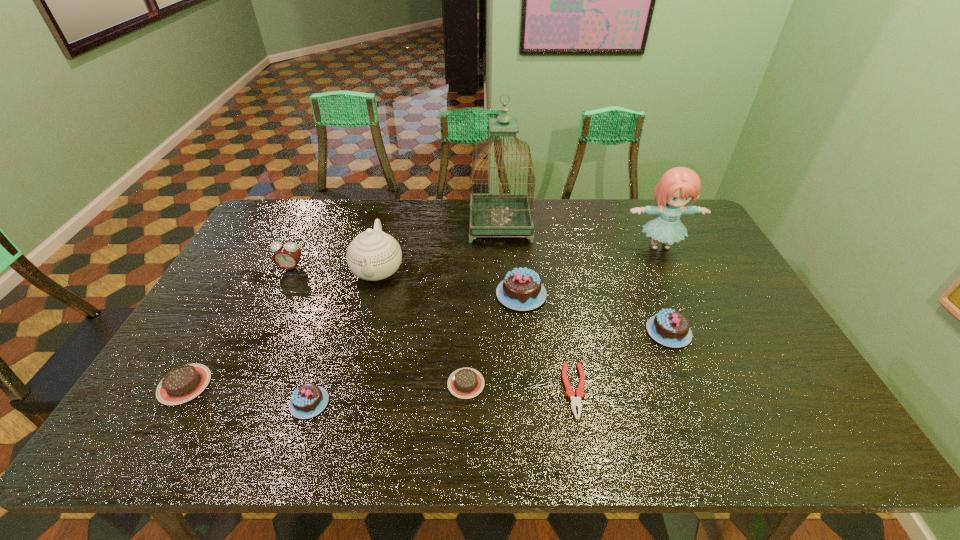
You are a GUI agent. You are given a task and a screenshot of the screen. Output one action in this format:
    pyautogui.click(x=<x>, y=<y>)
    Task: Click on the birdcage
    The width and height of the screenshot is (960, 540).
    Given the screenshot: What is the action you would take?
    pyautogui.click(x=490, y=214)

Locate an element on the screen. Image resolution: width=960 pixels, height=540 pixels. greenish birdcage is located at coordinates (490, 214).

Where is `blue doll`? blue doll is located at coordinates (677, 186).

The width and height of the screenshot is (960, 540). Identify the location of the ninth shortest object. (677, 186).

Where is `the eighth shortest object`? the eighth shortest object is located at coordinates (373, 255).

At what (x,y) coordinates should I click in order to perform the action: click on pink alarm clock. Please return your answer as a coordinate pair (x, y). Looking at the image, I should click on (286, 256).

I want to click on the ninth object from right to left, so click(286, 256).

You are a GUI agent. You are given a task and a screenshot of the screen. Output one action in this format:
    pyautogui.click(x=<x>, y=<y>)
    Task: Click on the sixth shortest object
    
    Given the screenshot: What is the action you would take?
    pyautogui.click(x=521, y=289)

The height and width of the screenshot is (540, 960). Identify the location of the farthest chocolate cake. (521, 289).

I want to click on the rightmost pink chocolate cake, so click(x=671, y=328).